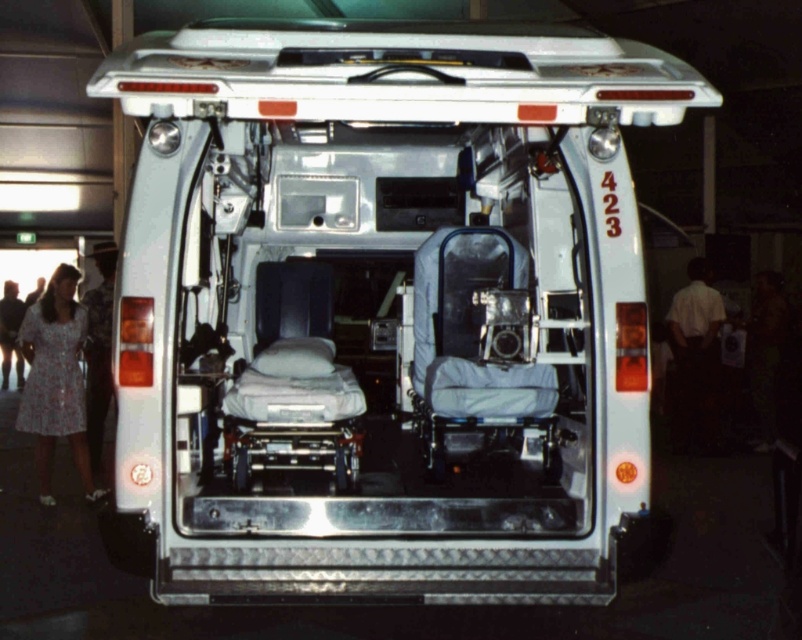
Question: Which point is farther from the camera taking this photo?

Choices:
 (A) (94, 401)
 (B) (555, 524)
 (C) (27, 358)
 (D) (711, 448)

Answer: (D)

Question: Which point is farther from the camera taking this photo?

Choices:
 (A) (689, 332)
 (B) (678, 74)
 (C) (3, 308)

Answer: (C)

Question: Which of these objects is positioned farthest from the light blue dress at lower left?

Choices:
 (A) matte gray ambulance at center
 (B) floral dress at left
 (C) patterned fabric dress at left
 (D) white shirt at right

Answer: (A)

Question: Can you confirm if matte gray ambulance at center is positioned below patterned fabric dress at left?

Choices:
 (A) no
 (B) yes

Answer: (A)

Question: Can you confirm if patterned fabric dress at left is smaller than light blue dress at lower left?

Choices:
 (A) yes
 (B) no

Answer: (A)

Question: Observing the image, what is the correct spatial positioning of white shirt at right in reference to patterned fabric dress at left?

Choices:
 (A) left
 (B) right

Answer: (B)